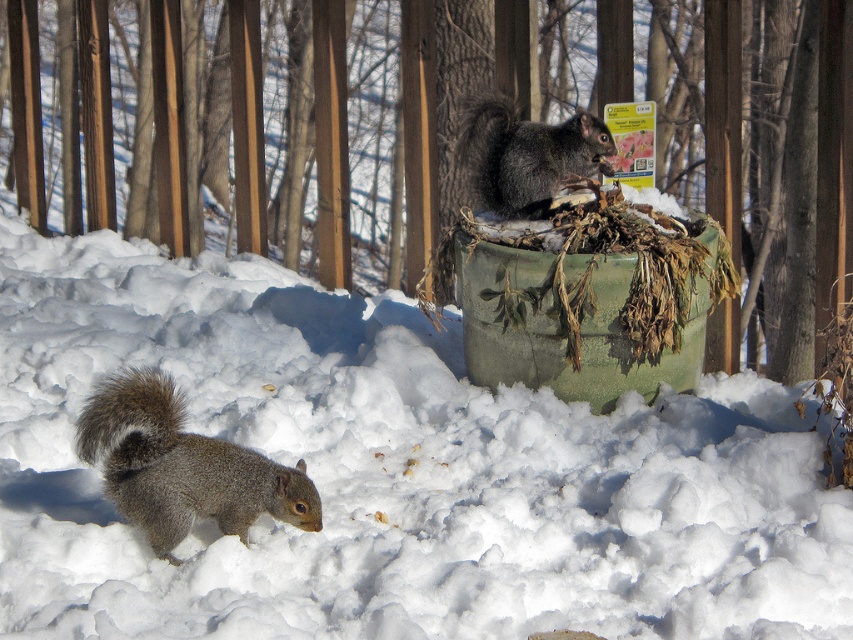
You are a photographer trying to capture the gray furry squirrel at lower left in the snow. Since the white fluffy snow at lower center is in the way, can you still take a clear photo of the squirrel?

The white fluffy snow at lower center is larger in size than gray furry squirrel at lower left. However, since the snow is at the lower center and the squirrel is at the lower left, the photographer can adjust the camera angle to focus on the squirrel without the snow blocking the view.

You are a photographer trying to capture the gray furry squirrel at lower left without the white fluffy snow at lower center appearing in the foreground. Is this possible given their positions?

The white fluffy snow at lower center is closer to the viewer than the gray furry squirrel at lower left. Therefore, it would be challenging to capture the squirrel without the snow in the foreground since the snow is in front of the squirrel.